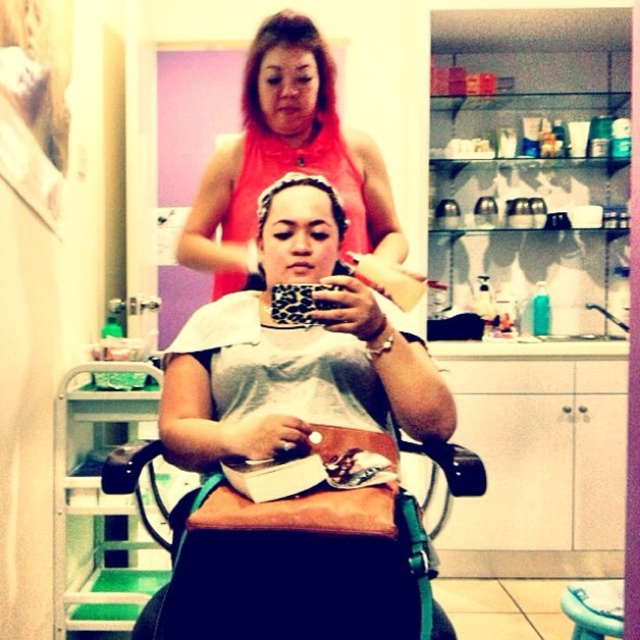
Question: Does brown shiny hair at upper center have a lesser width compared to brown matte hair at center?

Choices:
 (A) no
 (B) yes

Answer: (A)

Question: Can you confirm if leather belt at center is positioned to the right of pink matte tank top at upper center?

Choices:
 (A) yes
 (B) no

Answer: (A)

Question: Does leather belt at center appear over brown shiny hair at upper center?

Choices:
 (A) no
 (B) yes

Answer: (A)

Question: Which of the following is the farthest from the observer?

Choices:
 (A) (264, 209)
 (B) (294, 16)
 (C) (275, 141)
 (D) (620, 595)

Answer: (C)

Question: Which object is the farthest from the brown shiny hair at upper center?

Choices:
 (A) brown matte hair at center
 (B) leather belt at center
 (C) wooden stool at lower right

Answer: (C)

Question: Which point is farther to the camera?

Choices:
 (A) (589, 627)
 (B) (262, 221)
 (C) (412, 358)

Answer: (B)